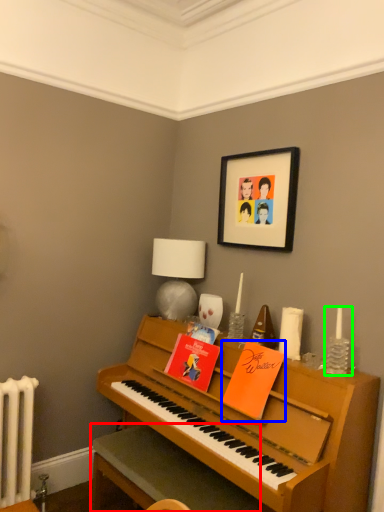
Question: Which object is positioned closest to table (highlighted by a red box)? Select from book (highlighted by a blue box) and candle holder (highlighted by a green box).

Choices:
 (A) book
 (B) candle holder

Answer: (A)